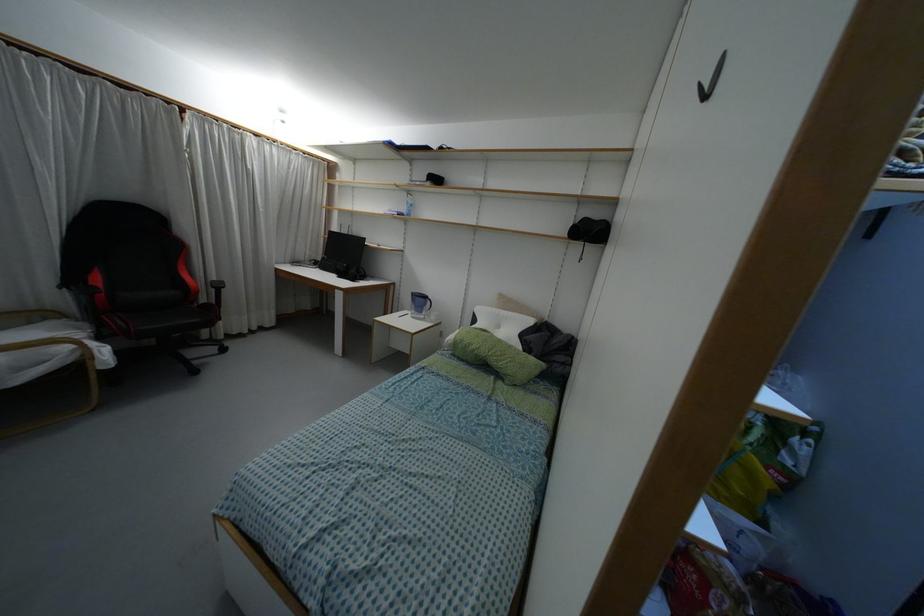
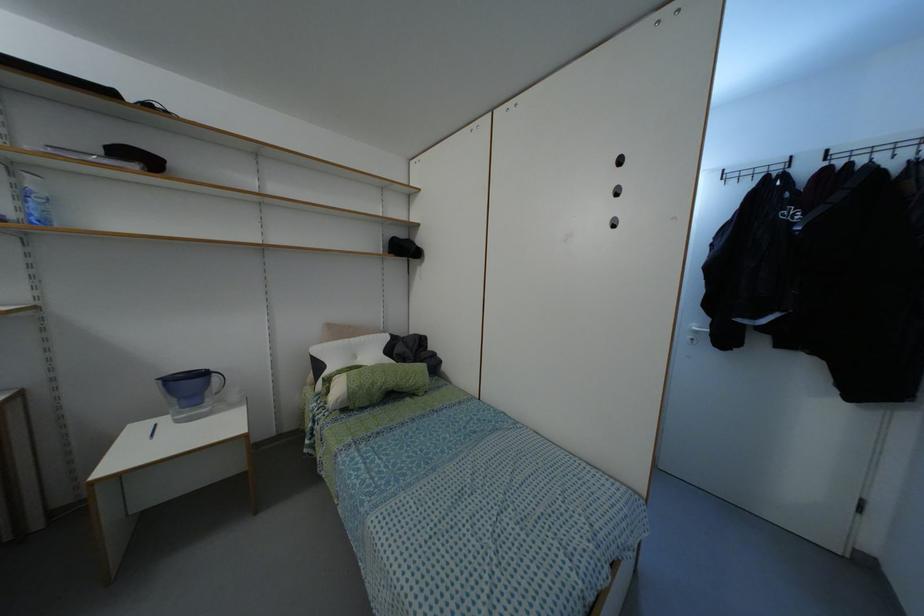
Where in the second image is the point corresponding to pixel 428 302 from the first image?

(214, 378)